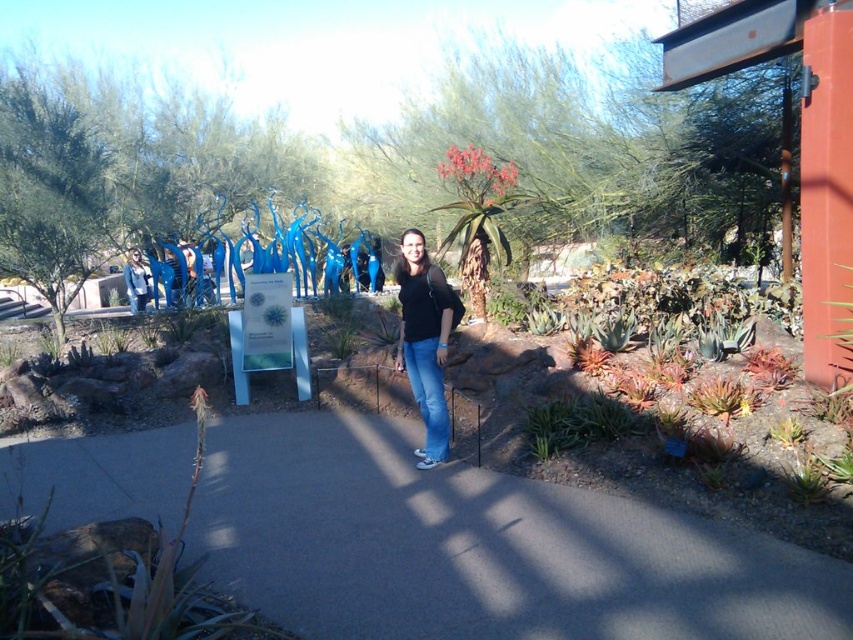
Question: Does blue denim jeans at center appear over matte black jacket at center?

Choices:
 (A) no
 (B) yes

Answer: (A)

Question: Can you confirm if black matte shirt at center is positioned below matte black jacket at center?

Choices:
 (A) no
 (B) yes

Answer: (B)

Question: Which point is farther to the camera?

Choices:
 (A) blue denim jeans at center
 (B) gray concrete path at center

Answer: (A)

Question: Estimate the real-world distances between objects in this image. Which object is closer to the blue denim jeans at center?

Choices:
 (A) black matte shirt at center
 (B) gray concrete path at center
 (C) matte black jacket at center

Answer: (A)

Question: Does blue denim jeans at center have a smaller size compared to matte black jacket at center?

Choices:
 (A) yes
 (B) no

Answer: (A)

Question: Which object is positioned closest to the blue denim jeans at center?

Choices:
 (A) gray concrete path at center
 (B) matte black jacket at center
 (C) black matte shirt at center

Answer: (C)